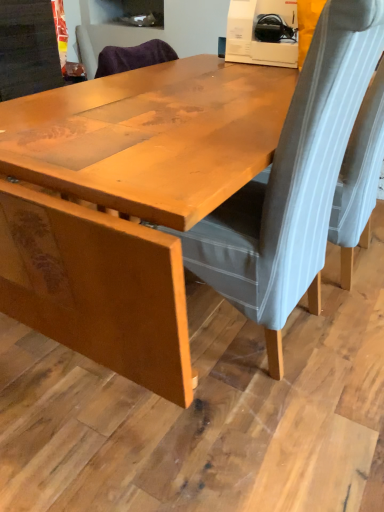
Where is `free point below velvet grey chair at center, the second chair in the right-to-left sequence (from a real-world perspective)`? free point below velvet grey chair at center, the second chair in the right-to-left sequence (from a real-world perspective) is located at coordinates (226, 325).